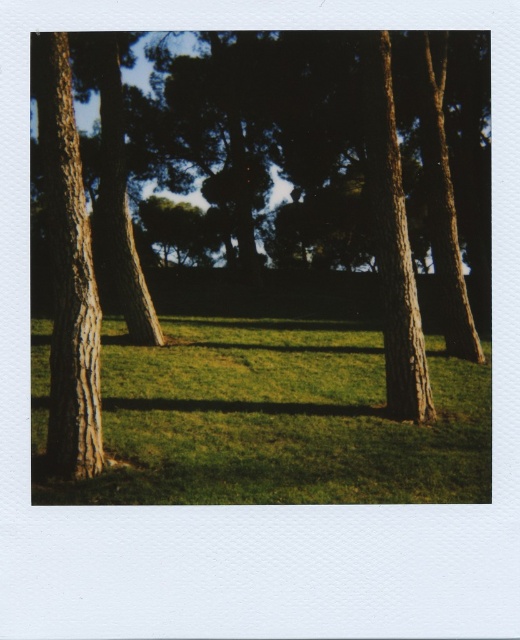
You are standing in the middle of a forest clearing and see the green grass at center and the brown rough bark tree at center. Which object is directly above the other?

The brown rough bark tree at center is directly above the green grass at center because the green grass at center is positioned under it.

You are standing at the center of the image and want to place a small garden gnome exactly where the green grass at center is located. What are the coordinates you should aim for?

The coordinates for the green grass at center are at point (x=279, y=420).